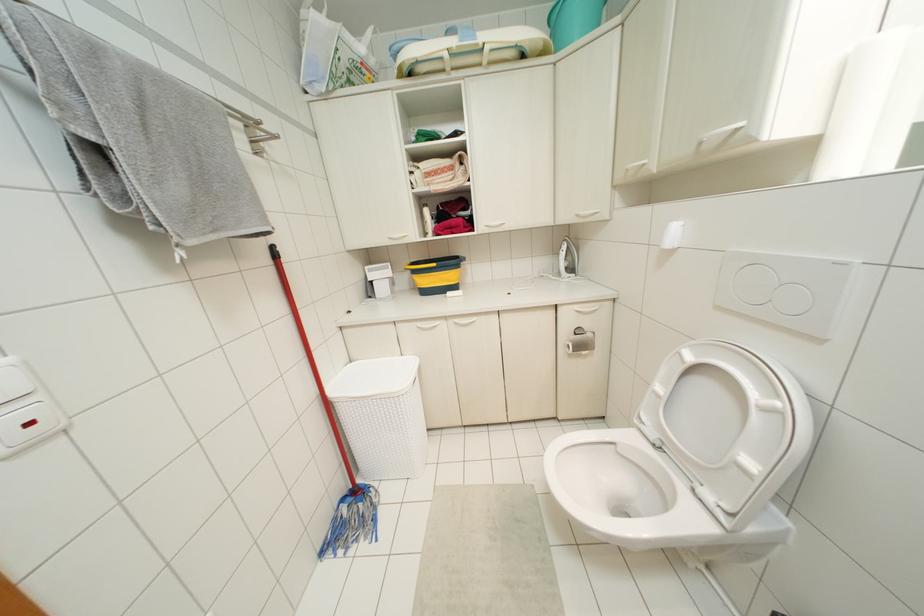
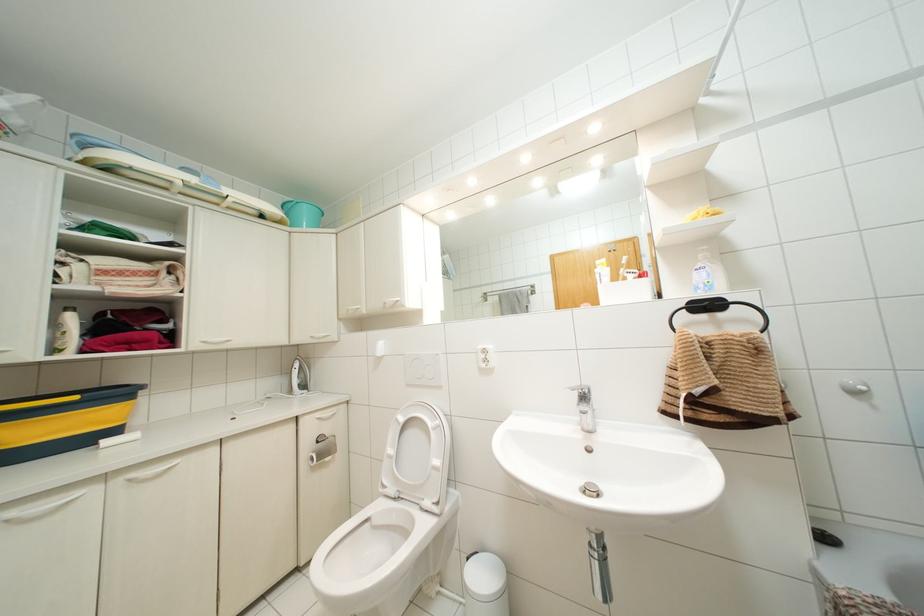
In the second image, find the point that corresponds to (x=433, y=264) in the first image.

(75, 397)